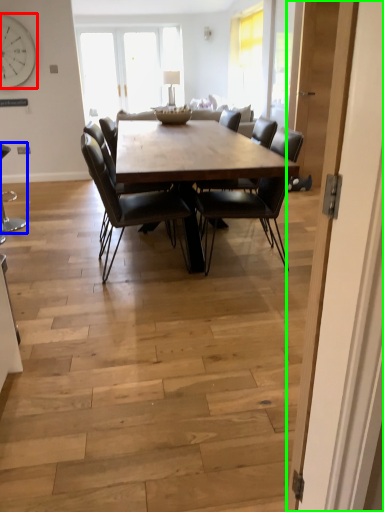
Question: Which is farther away from clock (highlighted by a red box)? chair (highlighted by a blue box) or door (highlighted by a green box)?

Choices:
 (A) chair
 (B) door

Answer: (B)